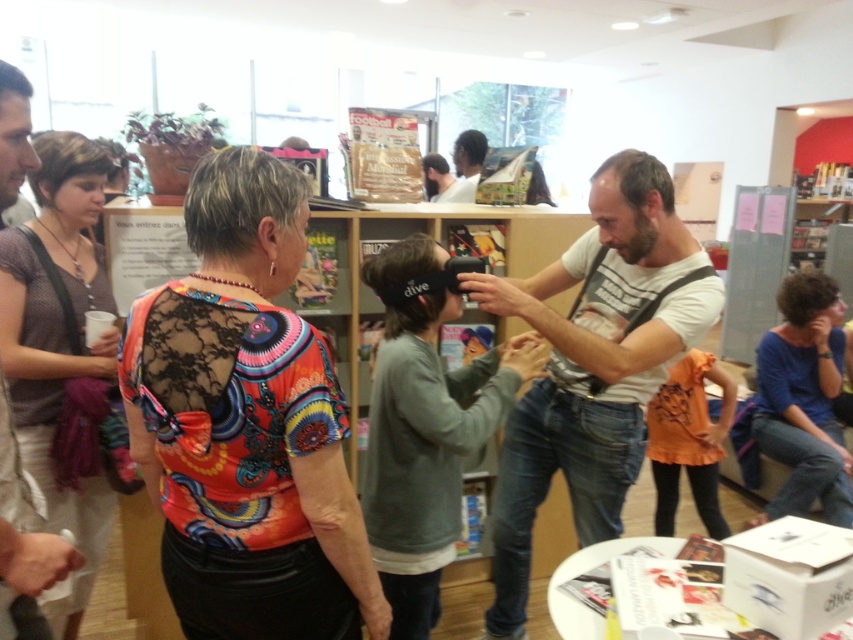
Between multicolored lace top at center and white cotton t-shirt at center, which one is positioned lower?

white cotton t-shirt at center

Does multicolored lace top at center have a smaller size compared to white cotton t-shirt at center?

Indeed, multicolored lace top at center has a smaller size compared to white cotton t-shirt at center.

Locate an element on the screen. multicolored lace top at center is located at coordinates (247, 422).

Which of these two, matte gray shirt at center or blue cotton shirt at lower right, stands shorter?

With less height is blue cotton shirt at lower right.

Who is more distant from viewer, (96, 513) or (805, 387)?

The point (805, 387) is behind.

Which is in front, point (90, 372) or point (788, 378)?

Point (90, 372)

I want to click on matte gray shirt at center, so click(62, 348).

Between multicolored lace top at center and matte white shirt at upper center, which one appears on the left side from the viewer's perspective?

multicolored lace top at center

Does multicolored lace top at center have a smaller size compared to matte white shirt at upper center?

No.

Is point (206, 509) in front of point (465, 140)?

Yes.

Where is `multicolored lace top at center`? multicolored lace top at center is located at coordinates (247, 422).